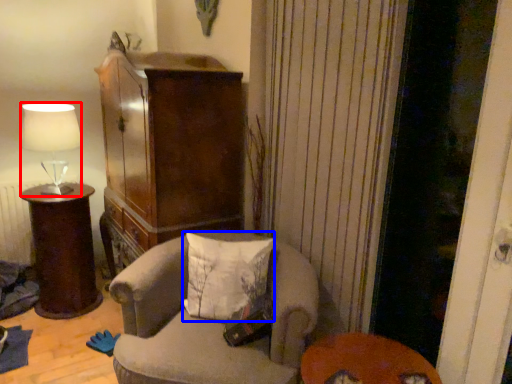
Question: Which object appears farthest to the camera in this image, lamp (highlighted by a red box) or pillow (highlighted by a blue box)?

Choices:
 (A) lamp
 (B) pillow

Answer: (A)